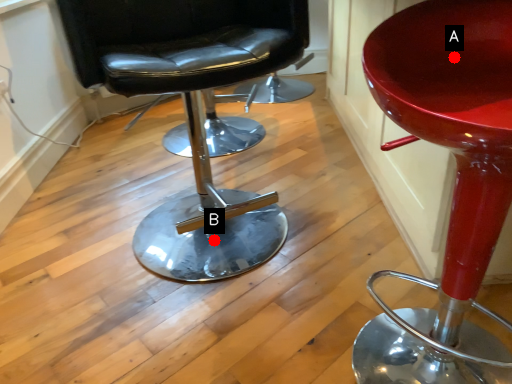
Question: Two points are circled on the image, labeled by A and B beside each circle. Among these points, which one is farthest from the camera?

Choices:
 (A) A is further
 (B) B is further

Answer: (B)